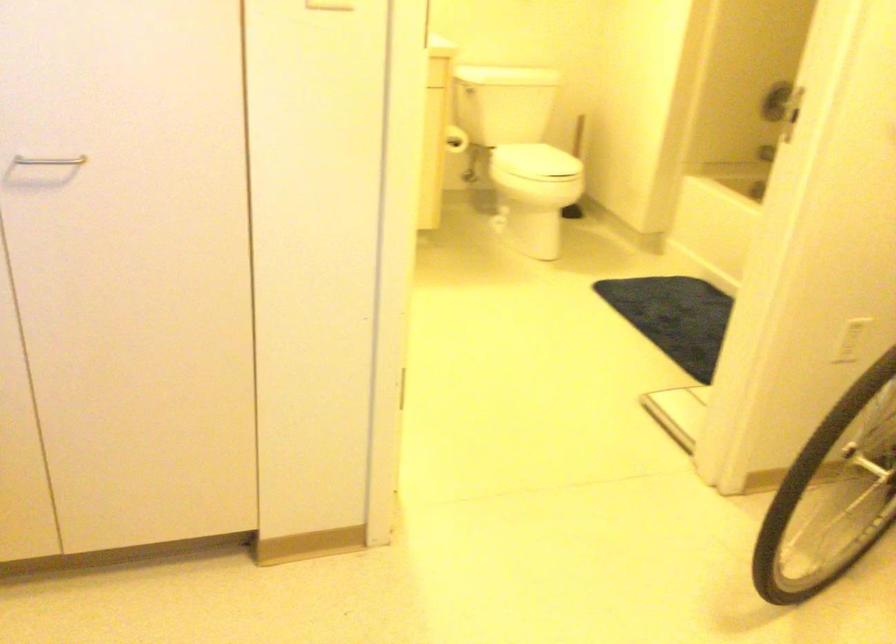
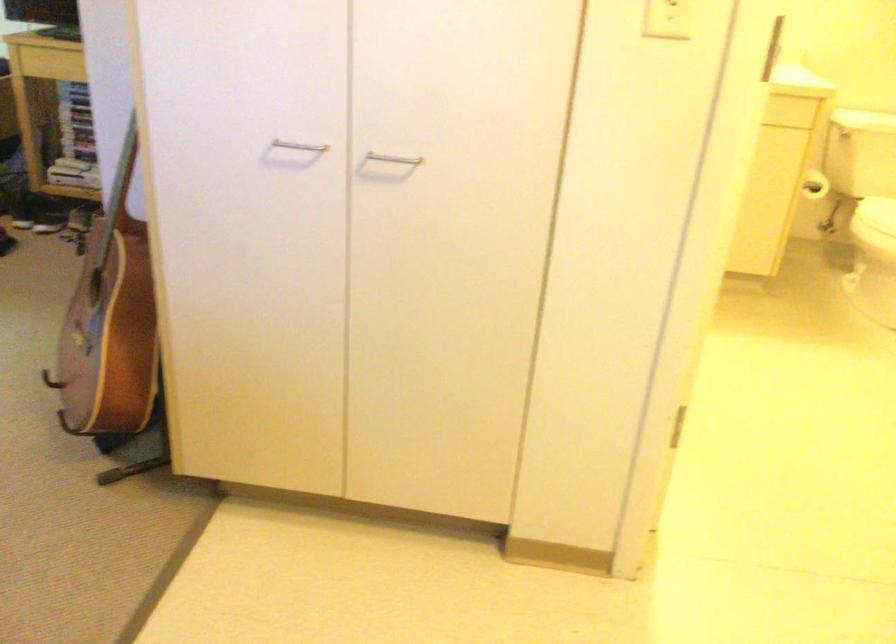
The point at (x=455, y=146) is marked in the first image. Where is the corresponding point in the second image?

(814, 185)